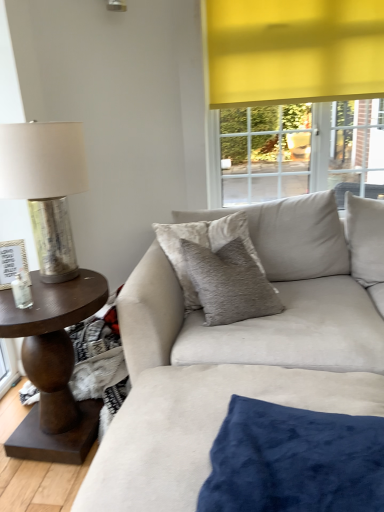
Locate an element on the screen. The width and height of the screenshot is (384, 512). suede couch at center is located at coordinates (237, 356).

You are a GUI agent. You are given a task and a screenshot of the screen. Output one action in this format:
    pyautogui.click(x=<x>, y=<y>)
    Task: Click on the dark brown wood side table at left
    This screenshot has width=384, height=512.
    Given the screenshot: What is the action you would take?
    (53, 367)

The height and width of the screenshot is (512, 384). In order to click on suede couch at center in this screenshot , I will do `click(237, 356)`.

From a real-world perspective, which object stands above the other?

From a 3D spatial view, velvet beige pillow at center, the 1th pillow from the top, is above.

Is velvet beige pillow at center, positioned as the 2th pillow in front-to-back order, at the back of suede couch at center?

Yes.

Considering the relative positions of suede couch at center and velvet beige pillow at center, positioned as the 2th pillow in front-to-back order, in the image provided, is suede couch at center to the right of velvet beige pillow at center, positioned as the 2th pillow in front-to-back order, from the viewer's perspective?

Indeed, suede couch at center is positioned on the right side of velvet beige pillow at center, positioned as the 2th pillow in front-to-back order.

Does suede couch at center have a greater height compared to velvet beige pillow at center, which is the 2th pillow in bottom-to-top order?

Yes.

From the image's perspective, is velvet blue pillow at lower center, the second pillow in the back-to-front sequence, above dark brown wood side table at left?

No.

Between velvet blue pillow at lower center, the second pillow when ordered from top to bottom, and dark brown wood side table at left, which one has smaller size?

Smaller between the two is velvet blue pillow at lower center, the second pillow when ordered from top to bottom.

Is velvet blue pillow at lower center, which appears as the first pillow when ordered from the bottom, facing towards dark brown wood side table at left?

No.

Is velvet blue pillow at lower center, which appears as the first pillow when ordered from the bottom, outside of dark brown wood side table at left?

Absolutely, velvet blue pillow at lower center, which appears as the first pillow when ordered from the bottom, is external to dark brown wood side table at left.

What's the angular difference between suede couch at center and metallic silver table lamp at left's facing directions?

The angular difference between suede couch at center and metallic silver table lamp at left is 4.17 degrees.

Based on the photo, is metallic silver table lamp at left inside suede couch at center?

No, suede couch at center does not contain metallic silver table lamp at left.

Between suede couch at center and metallic silver table lamp at left, which one is positioned behind?

metallic silver table lamp at left is further away from the camera.

From a real-world perspective, is suede couch at center physically above metallic silver table lamp at left?

No, from a real-world perspective, suede couch at center is not over metallic silver table lamp at left

Is suede couch at center oriented towards velvet blue pillow at lower center, the 1th pillow positioned from the front?

Yes, suede couch at center is turned towards velvet blue pillow at lower center, the 1th pillow positioned from the front.

How distant is suede couch at center from velvet blue pillow at lower center, the 1th pillow positioned from the front?

They are 38.20 centimeters apart.

Considering the positions of points (156, 392) and (280, 509), is point (156, 392) closer to camera compared to point (280, 509)?

No, it is behind (280, 509).

Where is `coffee table behind the suede couch at center`? coffee table behind the suede couch at center is located at coordinates (53, 367).

Who is shorter, dark brown wood side table at left or suede couch at center?

dark brown wood side table at left.

Is dark brown wood side table at left smaller than suede couch at center?

Yes, dark brown wood side table at left is smaller than suede couch at center.

Is dark brown wood side table at left thinner than suede couch at center?

Indeed, dark brown wood side table at left has a lesser width compared to suede couch at center.

Consider the image. From a real-world perspective, is suede couch at center positioned under dark brown wood side table at left based on gravity?

No.

Is suede couch at center not close to dark brown wood side table at left?

No, there isn't a large distance between suede couch at center and dark brown wood side table at left.

Is suede couch at center inside or outside of dark brown wood side table at left?

suede couch at center lies outside dark brown wood side table at left.

Considering the positions of objects suede couch at center and dark brown wood side table at left in the image provided, who is more to the right, suede couch at center or dark brown wood side table at left?

suede couch at center is more to the right.

In the image, there is a dark brown wood side table at left. Where is `pillow below it (from the image's perspective)`? pillow below it (from the image's perspective) is located at coordinates (294, 461).

Is dark brown wood side table at left surrounding velvet blue pillow at lower center, the 1th pillow positioned from the front?

Definitely not — velvet blue pillow at lower center, the 1th pillow positioned from the front, is not inside dark brown wood side table at left.

Between point (20, 448) and point (366, 441), which one is positioned behind?

The point (20, 448) is behind.

Where is `studio couch below the velvet beige pillow at center, acting as the 1th pillow starting from the back (from a real-world perspective)`? Image resolution: width=384 pixels, height=512 pixels. studio couch below the velvet beige pillow at center, acting as the 1th pillow starting from the back (from a real-world perspective) is located at coordinates point(237,356).

Find the location of a particular element. The width and height of the screenshot is (384, 512). the 1st pillow positioned above the dark brown wood side table at left (from a real-world perspective) is located at coordinates (294, 461).

Considering their positions, is dark brown wood side table at left positioned further to velvet blue pillow at lower center, the second pillow in the back-to-front sequence, than metallic silver table lamp at left?

metallic silver table lamp at left lies further to velvet blue pillow at lower center, the second pillow in the back-to-front sequence, than the other object.

Based on their spatial positions, is dark brown wood side table at left or suede couch at center further from metallic silver table lamp at left?

suede couch at center is further to metallic silver table lamp at left.

Based on their spatial positions, is velvet beige pillow at center, which is the 2th pillow in bottom-to-top order, or suede couch at center further from dark brown wood side table at left?

Among the two, velvet beige pillow at center, which is the 2th pillow in bottom-to-top order, is located further to dark brown wood side table at left.

Which object lies further to the anchor point dark brown wood side table at left, velvet blue pillow at lower center, the second pillow in the back-to-front sequence, or metallic silver table lamp at left?

velvet blue pillow at lower center, the second pillow in the back-to-front sequence.

Which object lies nearer to the anchor point velvet blue pillow at lower center, the 1th pillow positioned from the front, dark brown wood side table at left or suede couch at center?

Among the two, suede couch at center is located nearer to velvet blue pillow at lower center, the 1th pillow positioned from the front.

Which object lies further to the anchor point suede couch at center, dark brown wood side table at left or metallic silver table lamp at left?

Based on the image, metallic silver table lamp at left appears to be further to suede couch at center.

Looking at the image, which one is located further to suede couch at center, velvet beige pillow at center, positioned as the 2th pillow in front-to-back order, or dark brown wood side table at left?

dark brown wood side table at left.

Based on their spatial positions, is metallic silver table lamp at left or dark brown wood side table at left closer to velvet blue pillow at lower center, the 1th pillow positioned from the front?

Among the two, dark brown wood side table at left is located nearer to velvet blue pillow at lower center, the 1th pillow positioned from the front.

Locate an element on the screen. table lamp positioned between suede couch at center and velvet beige pillow at center, positioned as the 2th pillow in front-to-back order, from near to far is located at coordinates [46, 186].

At what (x,y) coordinates should I click in order to perform the action: click on coffee table situated between metallic silver table lamp at left and velvet beige pillow at center, acting as the 1th pillow starting from the back, from left to right. Please return your answer as a coordinate pair (x, y). Looking at the image, I should click on (53, 367).

Identify the location of pillow between suede couch at center and velvet beige pillow at center, positioned as the 2th pillow in front-to-back order, along the z-axis. This screenshot has width=384, height=512. (294, 461).

Find the location of a particular element. pillow located between suede couch at center and metallic silver table lamp at left in the depth direction is located at coordinates (294, 461).